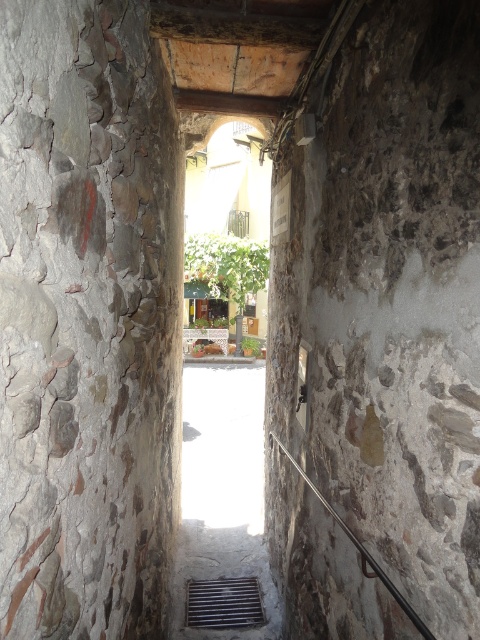
Question: Is metallic grate at lower center thinner than black metal rail at lower center?

Choices:
 (A) yes
 (B) no

Answer: (B)

Question: Which point is farther to the camera?

Choices:
 (A) metallic grate at lower center
 (B) black metal rail at lower center

Answer: (A)

Question: Which point is closer to the camera?

Choices:
 (A) metallic grate at lower center
 (B) black metal rail at lower center

Answer: (B)

Question: Observing the image, what is the correct spatial positioning of metallic grate at lower center in reference to black metal rail at lower center?

Choices:
 (A) left
 (B) right

Answer: (A)

Question: Does metallic grate at lower center lie in front of black metal rail at lower center?

Choices:
 (A) no
 (B) yes

Answer: (A)